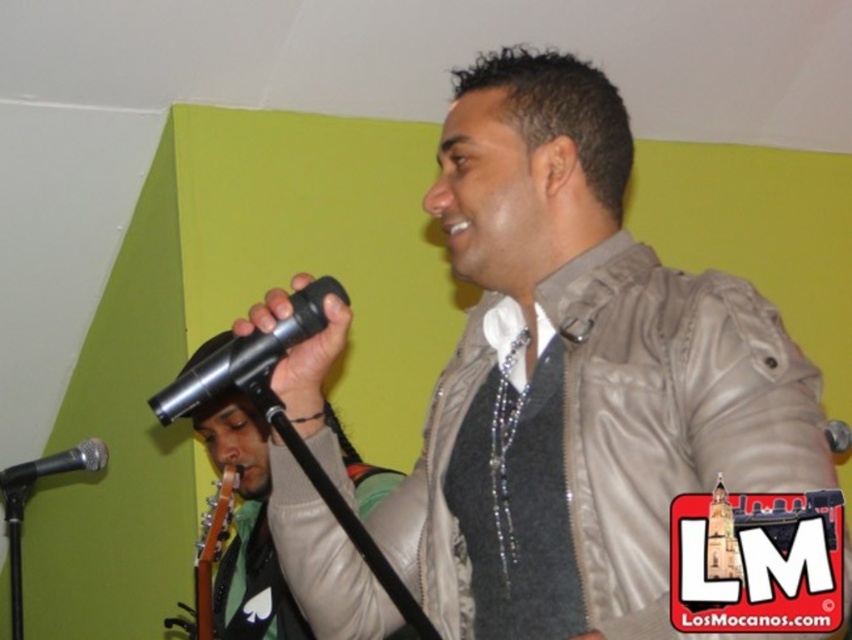
Does green matte sweater at center have a greater height compared to shiny metallic microphone at center?

Yes.

Locate an element on the screen. green matte sweater at center is located at coordinates (246, 529).

Who is positioned more to the left, matte beige jacket at center or shiny metallic microphone at center?

Positioned to the left is shiny metallic microphone at center.

Who is taller, matte beige jacket at center or shiny metallic microphone at center?

With more height is matte beige jacket at center.

Who is more distant from viewer, (496,541) or (274,356)?

The point (274,356) is more distant.

At what (x,y) coordinates should I click in order to perform the action: click on matte beige jacket at center. Please return your answer as a coordinate pair (x, y). The height and width of the screenshot is (640, 852). Looking at the image, I should click on click(x=579, y=378).

Does green matte sweater at center have a smaller size compared to metallic silver microphone at left?

No, green matte sweater at center is not smaller than metallic silver microphone at left.

Image resolution: width=852 pixels, height=640 pixels. Identify the location of green matte sweater at center. (246, 529).

Looking at this image, who is more forward, (237, 525) or (56, 472)?

Point (56, 472)

Identify the location of green matte sweater at center. Image resolution: width=852 pixels, height=640 pixels. (246, 529).